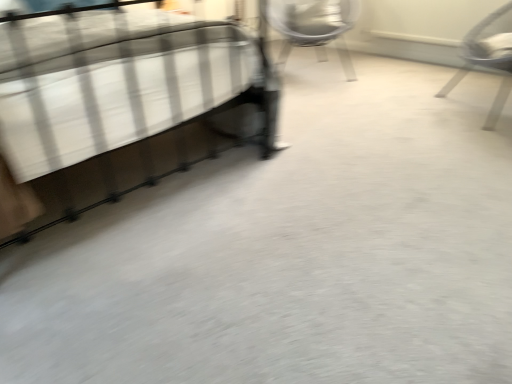
Question: Which direction should I rotate to look at metallic silver chair at upper center, marked as the 1th chair in a back-to-front arrangement, — up or down?

Choices:
 (A) down
 (B) up

Answer: (B)

Question: From the image's perspective, is metallic silver bed at left above metallic silver chair at upper center, which appears as the first chair when viewed from the left?

Choices:
 (A) yes
 (B) no

Answer: (B)

Question: Can you confirm if metallic silver bed at left is wider than metallic silver chair at upper center, marked as the 1th chair in a back-to-front arrangement?

Choices:
 (A) yes
 (B) no

Answer: (A)

Question: Is metallic silver bed at left not within metallic silver chair at upper center, which appears as the first chair when viewed from the left?

Choices:
 (A) no
 (B) yes

Answer: (B)

Question: From the image's perspective, is metallic silver bed at left below metallic silver chair at upper center, marked as the 1th chair in a back-to-front arrangement?

Choices:
 (A) no
 (B) yes

Answer: (B)

Question: Is metallic silver bed at left looking in the opposite direction of metallic silver chair at upper center, which is the 2th chair in front-to-back order?

Choices:
 (A) no
 (B) yes

Answer: (A)

Question: Considering the relative sizes of metallic silver bed at left and metallic silver chair at upper center, marked as the 1th chair in a back-to-front arrangement, in the image provided, is metallic silver bed at left smaller than metallic silver chair at upper center, marked as the 1th chair in a back-to-front arrangement,?

Choices:
 (A) yes
 (B) no

Answer: (B)

Question: Is metallic silver chair at right, arranged as the 1th chair when viewed from the front, at the right side of metallic silver bed at left?

Choices:
 (A) no
 (B) yes

Answer: (B)

Question: Does metallic silver chair at right, which appears as the 1th chair when viewed from the right, have a larger size compared to metallic silver bed at left?

Choices:
 (A) no
 (B) yes

Answer: (A)

Question: Is metallic silver chair at right, which appears as the 1th chair when viewed from the right, with metallic silver bed at left?

Choices:
 (A) yes
 (B) no

Answer: (B)

Question: From a real-world perspective, does metallic silver chair at right, arranged as the 1th chair when viewed from the front, sit lower than metallic silver bed at left?

Choices:
 (A) no
 (B) yes

Answer: (B)

Question: Is metallic silver chair at right, the 2th chair viewed from the left, closer to camera compared to metallic silver bed at left?

Choices:
 (A) yes
 (B) no

Answer: (B)

Question: Considering the relative sizes of metallic silver chair at right, arranged as the 1th chair when viewed from the front, and metallic silver bed at left in the image provided, is metallic silver chair at right, arranged as the 1th chair when viewed from the front, wider than metallic silver bed at left?

Choices:
 (A) no
 (B) yes

Answer: (A)

Question: Does metallic silver chair at upper center, marked as the 1th chair in a back-to-front arrangement, have a greater height compared to metallic silver bed at left?

Choices:
 (A) no
 (B) yes

Answer: (A)